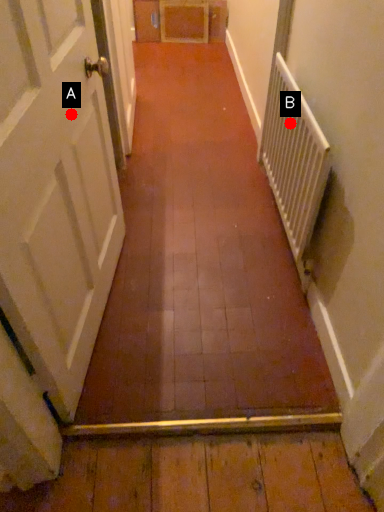
Question: Two points are circled on the image, labeled by A and B beside each circle. Which point is closer to the camera?

Choices:
 (A) A is closer
 (B) B is closer

Answer: (A)